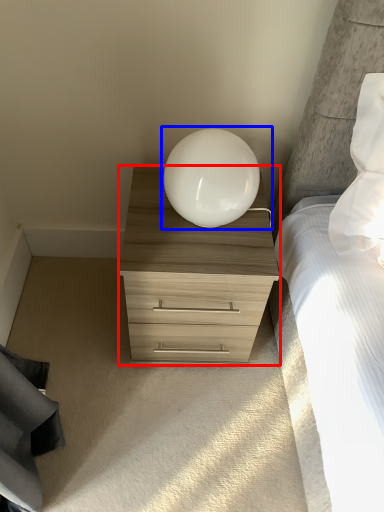
Question: Among these objects, which one is farthest to the camera, chest of drawers (highlighted by a red box) or table lamp (highlighted by a blue box)?

Choices:
 (A) chest of drawers
 (B) table lamp

Answer: (A)